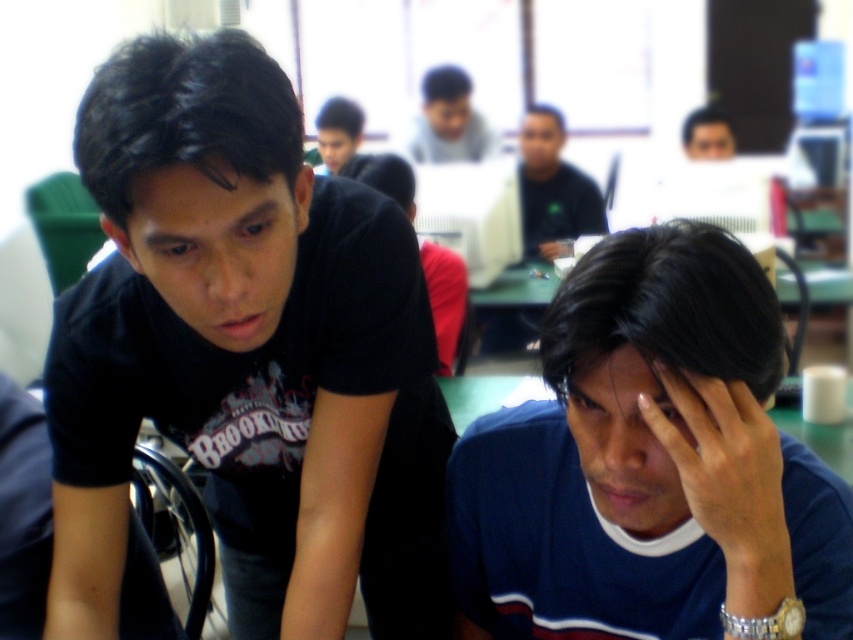
Can you confirm if dark blue fabric shirt at center is smaller than dark skin/hair at lower center?

Incorrect, dark blue fabric shirt at center is not smaller in size than dark skin/hair at lower center.

Is dark blue fabric shirt at center positioned at the back of dark skin/hair at lower center?

No, dark blue fabric shirt at center is in front of dark skin/hair at lower center.

Is point (570, 532) more distant than point (767, 502)?

Yes, point (570, 532) is behind point (767, 502).

Find the location of a particular element. dark blue fabric shirt at center is located at coordinates pyautogui.click(x=648, y=461).

Who is lower down, dark hair at upper center or matte black hair at upper center?

matte black hair at upper center

Can you confirm if dark hair at upper center is positioned above matte black hair at upper center?

Yes.

You are a GUI agent. You are given a task and a screenshot of the screen. Output one action in this format:
    pyautogui.click(x=<x>, y=<y>)
    Task: Click on the dark hair at upper center
    The height and width of the screenshot is (640, 853).
    Given the screenshot: What is the action you would take?
    pyautogui.click(x=445, y=100)

Can you confirm if matte black shirt at center is positioned to the right of black matte head at center?

Correct, you'll find matte black shirt at center to the right of black matte head at center.

Which is in front, point (554, 132) or point (387, 157)?

Point (387, 157)

Which is in front, point (590, 218) or point (415, 182)?

Point (415, 182) is in front.

Identify the location of matte black shirt at center. This screenshot has height=640, width=853. (552, 188).